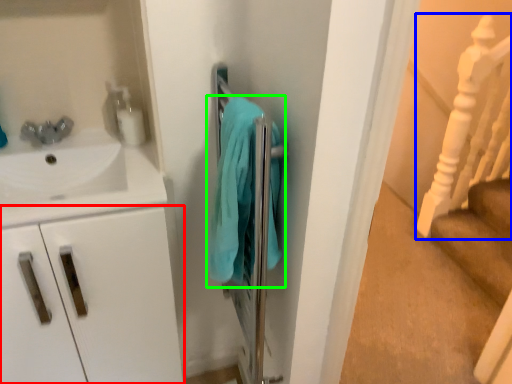
Question: Considering the real-world distances, which object is farthest from drawer (highlighted by a red box)? rail (highlighted by a blue box) or bath towel (highlighted by a green box)?

Choices:
 (A) rail
 (B) bath towel

Answer: (A)